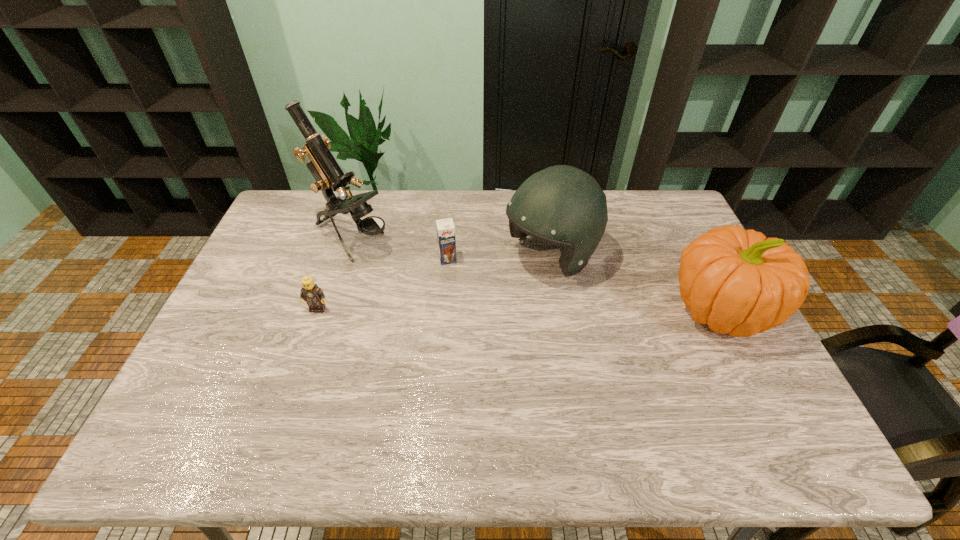
This screenshot has height=540, width=960. Find the location of `the shortest object`. the shortest object is located at coordinates (313, 295).

Where is `the rightmost object`? the rightmost object is located at coordinates (737, 281).

Where is `the tallest object`? the tallest object is located at coordinates (329, 177).

This screenshot has width=960, height=540. Identify the location of the third object from left to right. (445, 227).

This screenshot has height=540, width=960. Identify the location of the fourth tallest object. (445, 227).

Image resolution: width=960 pixels, height=540 pixels. Find the location of `football helmet`. football helmet is located at coordinates (562, 205).

Identify the location of free space located 0.140m in front of the shortest object. This screenshot has height=540, width=960. (302, 353).

The image size is (960, 540). Identify the location of free space located 0.090m through the eyepiece of the microscope. (401, 265).

The height and width of the screenshot is (540, 960). What are the coordinates of `blank space located through the eyepiece of the microscope` in the screenshot? It's located at (432, 282).

This screenshot has height=540, width=960. What are the coordinates of `free space located through the eyepiece of the microscope` in the screenshot? It's located at (468, 302).